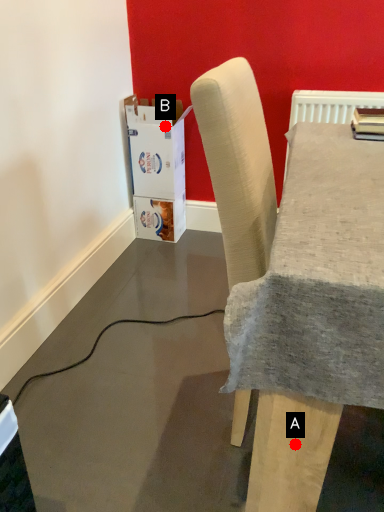
Question: Two points are circled on the image, labeled by A and B beside each circle. Which point is closer to the camera?

Choices:
 (A) A is closer
 (B) B is closer

Answer: (A)